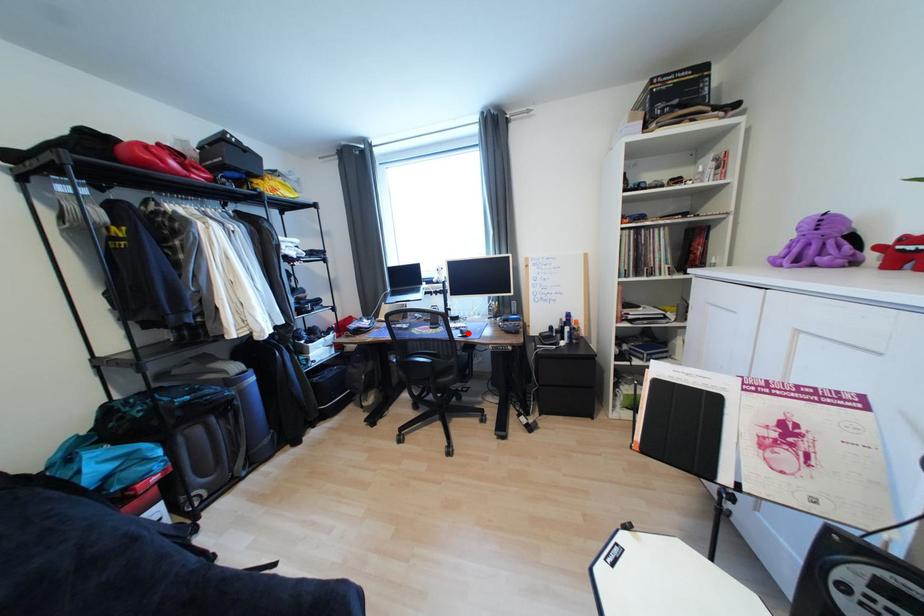
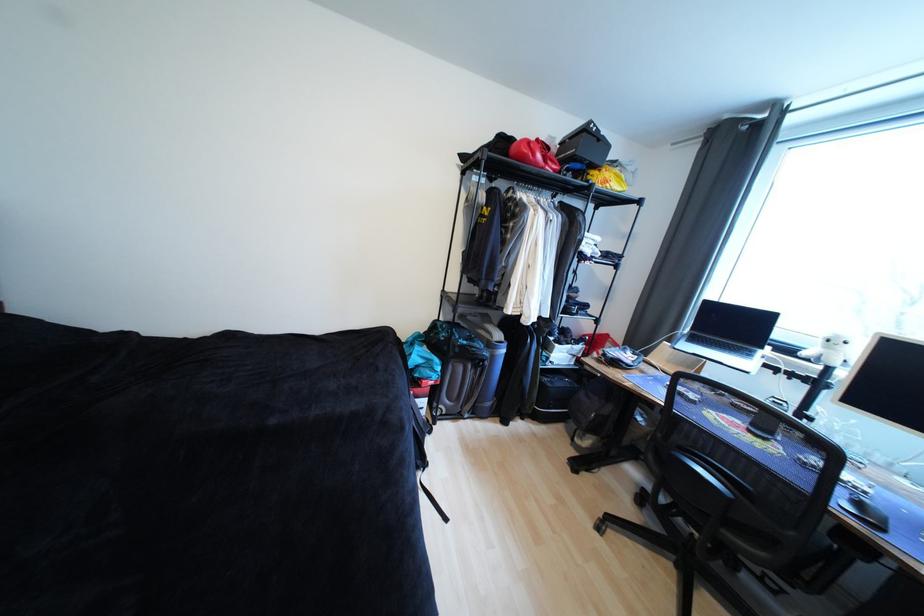
The point at the highlighted location is marked in the first image. Where is the corresponding point in the second image?

(867, 506)